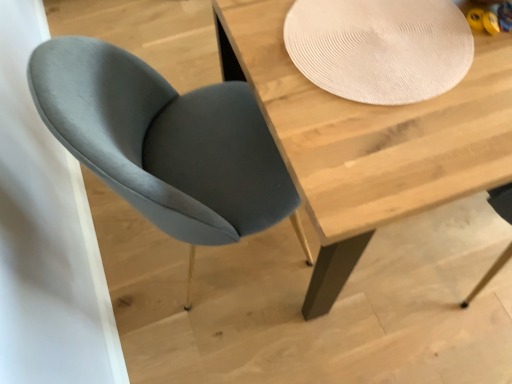
Where is `vacant location below beige textured placemat at upper center (from a real-world perspective)`? This screenshot has height=384, width=512. vacant location below beige textured placemat at upper center (from a real-world perspective) is located at coordinates point(376,44).